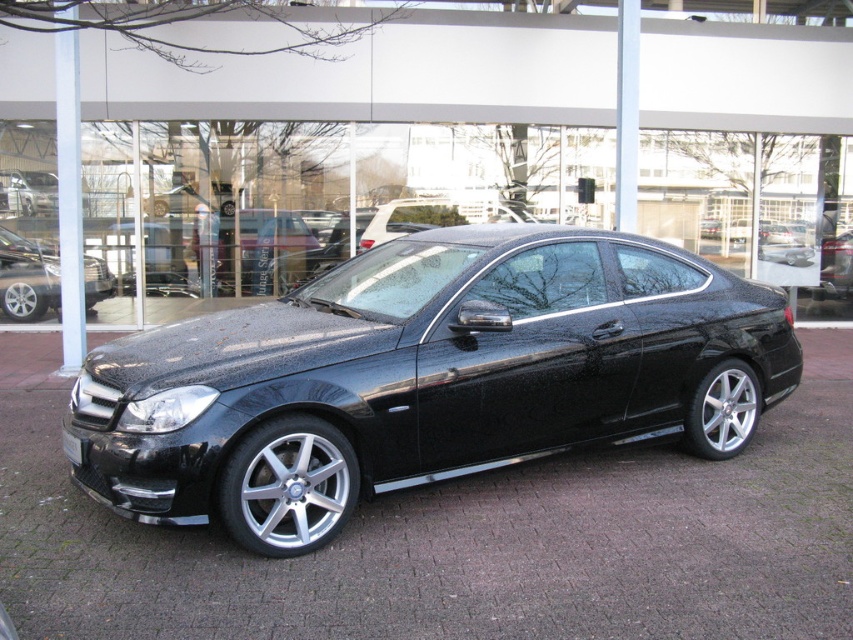
Does black metallic car at center have a larger size compared to shiny metallic car at center?

Indeed, black metallic car at center has a larger size compared to shiny metallic car at center.

Looking at this image, measure the distance between black metallic car at center and camera.

black metallic car at center and camera are 3.58 meters apart.

This screenshot has width=853, height=640. What are the coordinates of `black metallic car at center` in the screenshot? It's located at (425, 376).

Which is above, shiny metallic car at center or black glossy license plate at front?

shiny metallic car at center is above.

Does shiny metallic car at center appear over black glossy license plate at front?

Correct, shiny metallic car at center is located above black glossy license plate at front.

Who is more distant from viewer, (88, 276) or (74, 445)?

Positioned behind is point (88, 276).

Image resolution: width=853 pixels, height=640 pixels. Identify the location of shiny metallic car at center. (27, 276).

Does point (302, 321) come closer to viewer compared to point (80, 458)?

No, (302, 321) is further to viewer.

Locate an element on the screen. black metallic car at center is located at coordinates (425, 376).

This screenshot has height=640, width=853. Find the location of `black metallic car at center`. black metallic car at center is located at coordinates (425, 376).